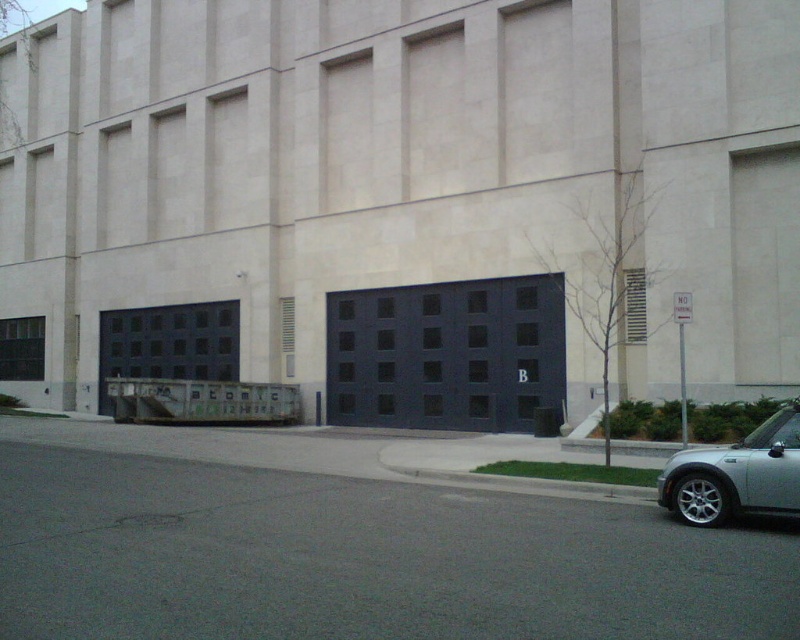
You are standing in front of the large modern building and want to locate the dark matte garage door at center. According to the coordinates provided, where would you find it in relation to the beige stone facade?

The dark matte garage door at center is located at the coordinates point (x=448, y=355) on the beige stone facade.

You are a delivery driver who needs to park your silver metallic car at lower right. The parking space is designed to fit vehicles as wide as the dark matte garage door at center. Will your car fit in the parking space?

The dark matte garage door at center is thinner than the silver metallic car at lower right, meaning the car is wider. Since the parking space is designed for the garage door width, the silver metallic car at lower right will not fit.

You are a delivery driver who needs to park your silver metallic car at lower right near the dark matte garage door at center. Based on the scene, can you park your car to the left of the garage door?

The dark matte garage door at center is to the right of the silver metallic car at lower right, so the car is already positioned to the left of the garage door. Therefore, you can park your car there as it is already in the correct position.